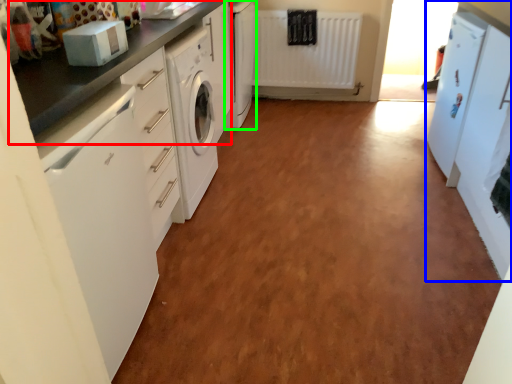
Question: Which is nearer to the countertop (highlighted by a red box)? cabinetry (highlighted by a blue box) or cabinetry (highlighted by a green box).

Choices:
 (A) cabinetry
 (B) cabinetry

Answer: (B)